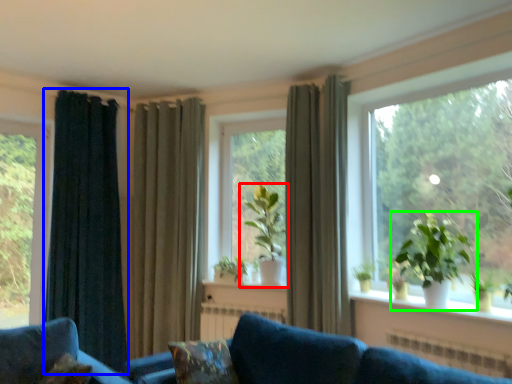
Question: Based on their relative distances, which object is nearer to houseplant (highlighted by a red box)? Choose from curtain (highlighted by a blue box) and houseplant (highlighted by a green box).

Choices:
 (A) curtain
 (B) houseplant

Answer: (B)